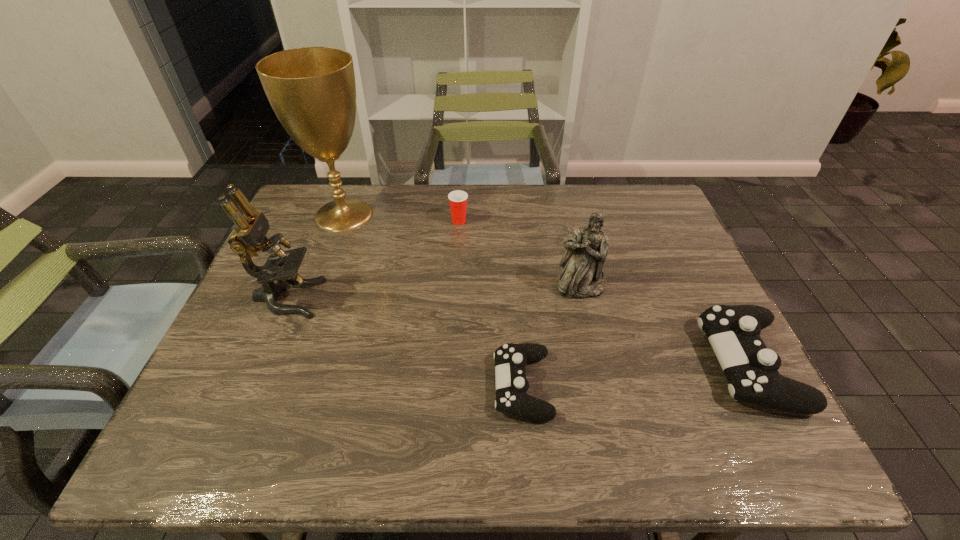
Locate an element on the screen. free space for a new control on the left is located at coordinates (276, 409).